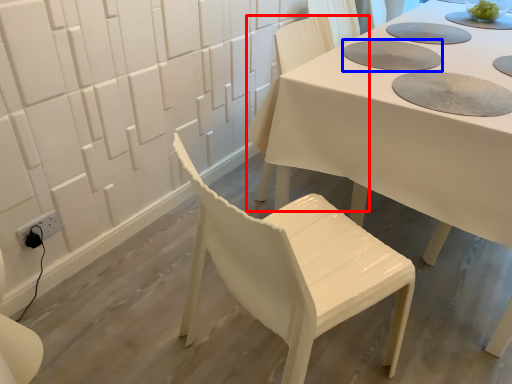
Question: Which of the following is the farthest to the observer, chair (highlighted by a red box) or paper plate (highlighted by a blue box)?

Choices:
 (A) chair
 (B) paper plate

Answer: (A)